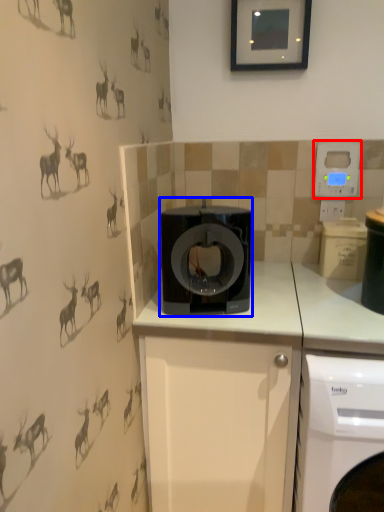
Question: Which object appears farthest to the camera in this image, thermostat (highlighted by a red box) or home appliance (highlighted by a blue box)?

Choices:
 (A) thermostat
 (B) home appliance

Answer: (A)